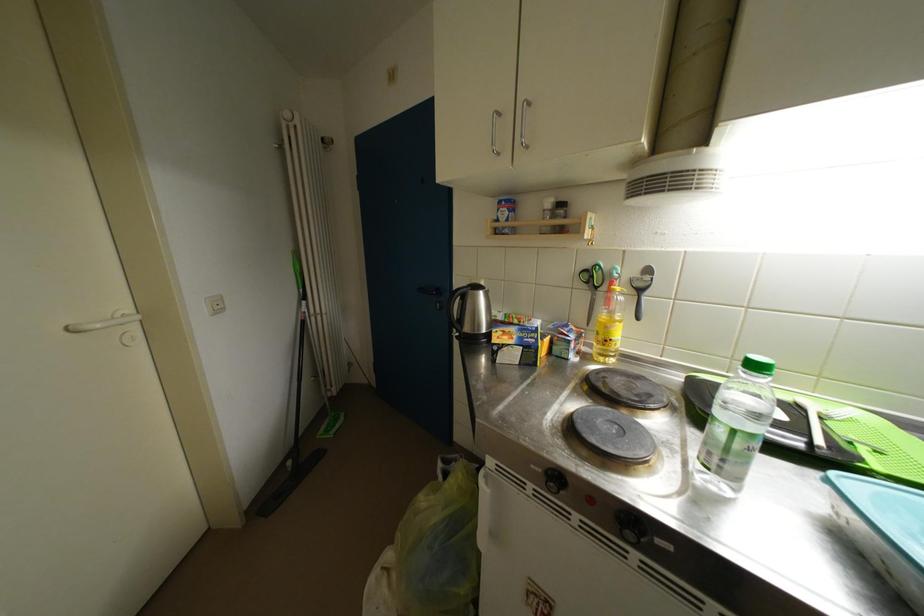
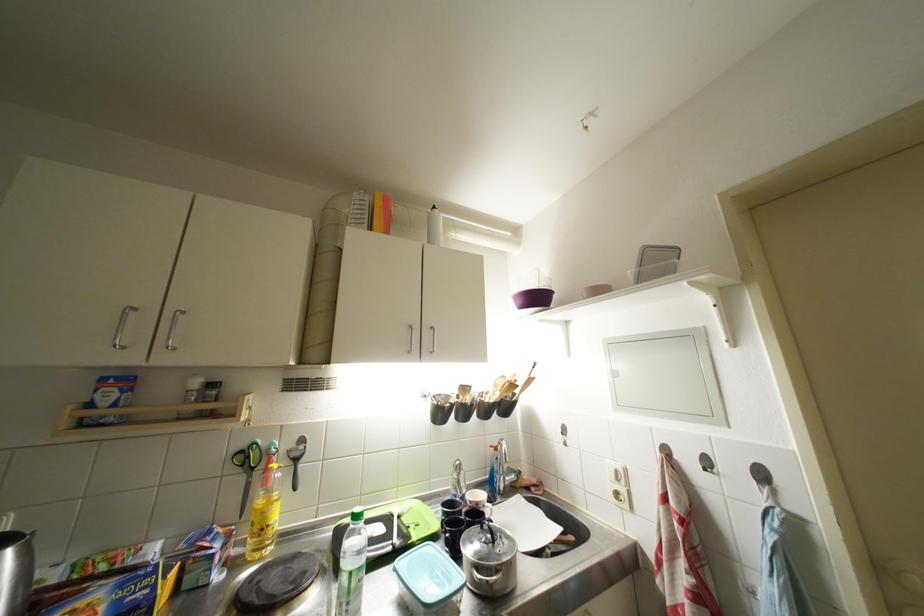
Locate, in the second image, the point that corresponds to pixel 643 278 in the first image.

(299, 450)